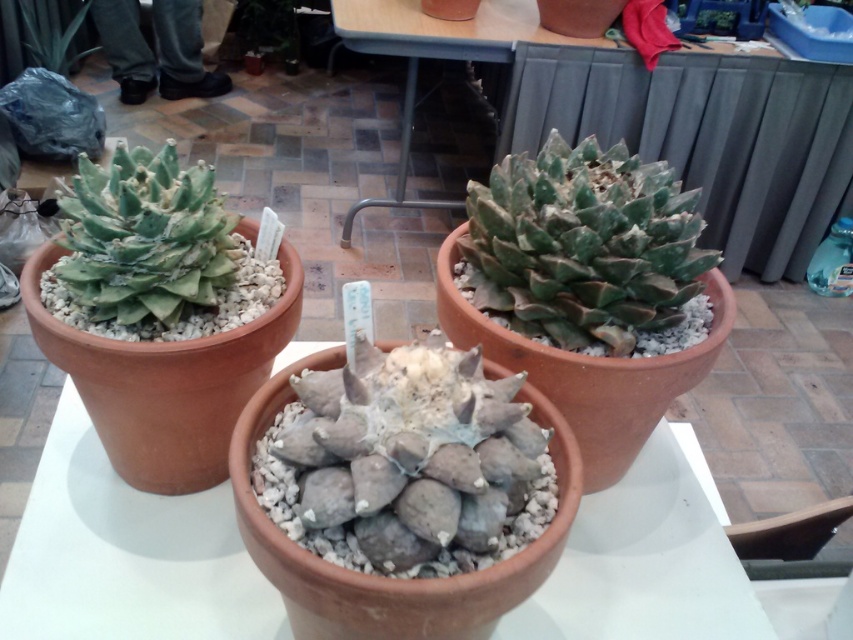
Question: Does green matte succulent at center appear under green succulent at upper left?

Choices:
 (A) yes
 (B) no

Answer: (A)

Question: Considering the real-world distances, which object is closest to the green matte succulent at left?

Choices:
 (A) green matte succulent at center
 (B) green succulent at upper left

Answer: (A)

Question: Which object is closer to the camera taking this photo?

Choices:
 (A) green matte succulent at center
 (B) green matte succulent at left
 (C) matte clay pot at center

Answer: (B)

Question: Is green matte succulent at center closer to camera compared to green succulent at upper left?

Choices:
 (A) yes
 (B) no

Answer: (A)

Question: Can you confirm if green matte succulent at center is thinner than green succulent at upper left?

Choices:
 (A) no
 (B) yes

Answer: (A)

Question: Which of the following is the closest to the observer?

Choices:
 (A) green matte succulent at left
 (B) green matte succulent at center
 (C) matte clay pot at center

Answer: (A)